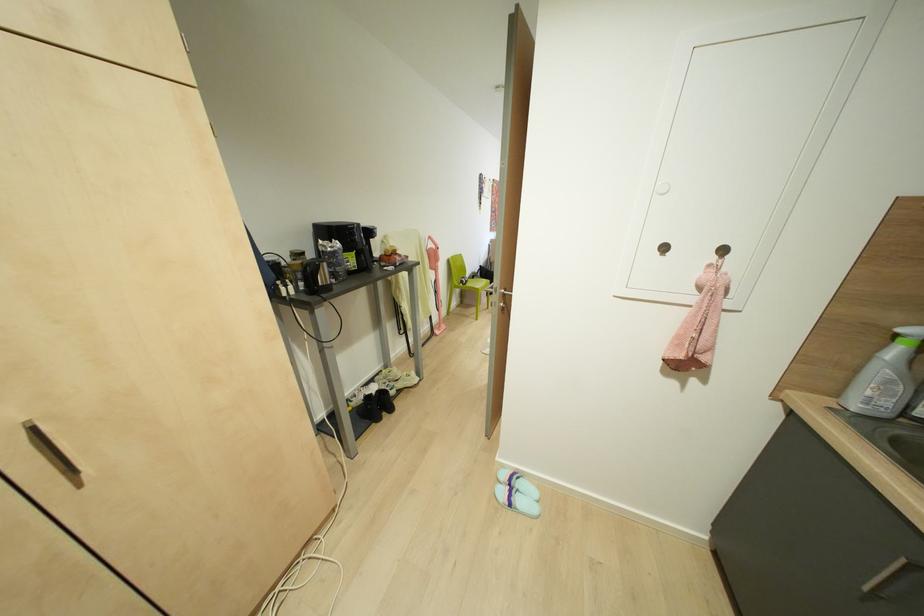
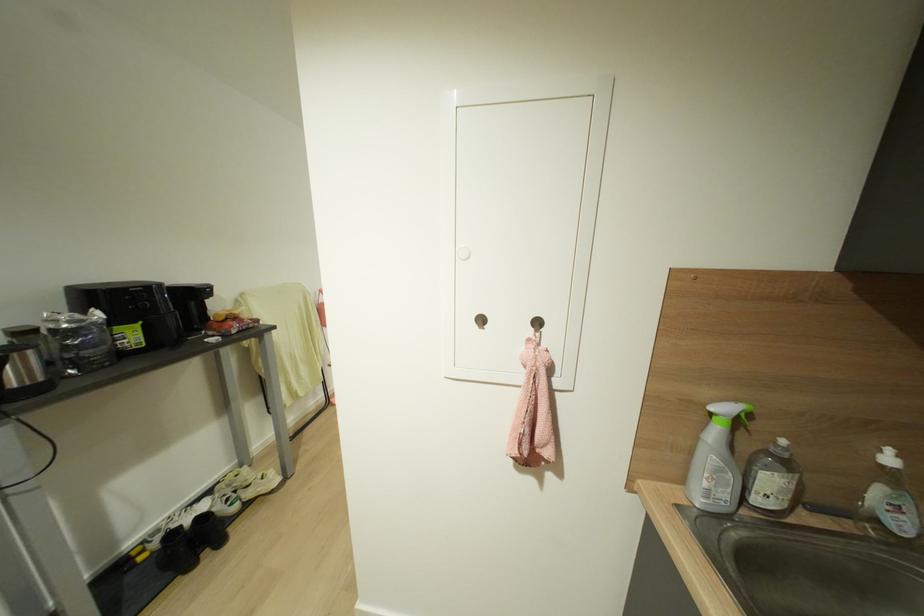
The point at (378, 419) is marked in the first image. Where is the corresponding point in the second image?

(189, 565)